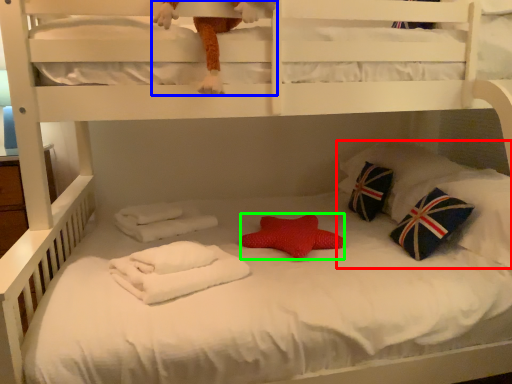
Question: Estimate the real-world distances between objects in this image. Which object is farther from pillow (highlighted by a red box), toy (highlighted by a blue box) or throw pillow (highlighted by a green box)?

Choices:
 (A) toy
 (B) throw pillow

Answer: (A)